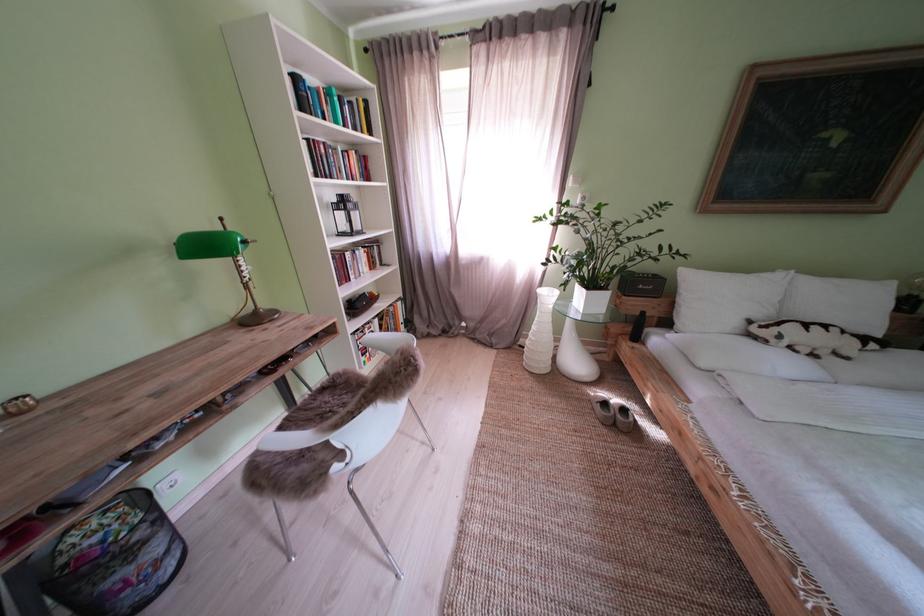
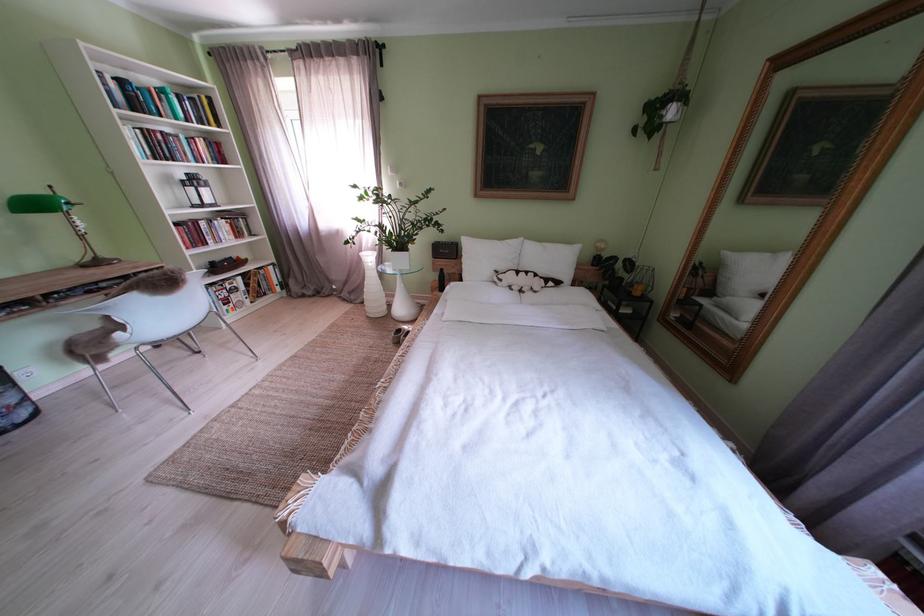
Where in the second image is the point corresponding to the point at 792,342 from the first image?

(512, 285)